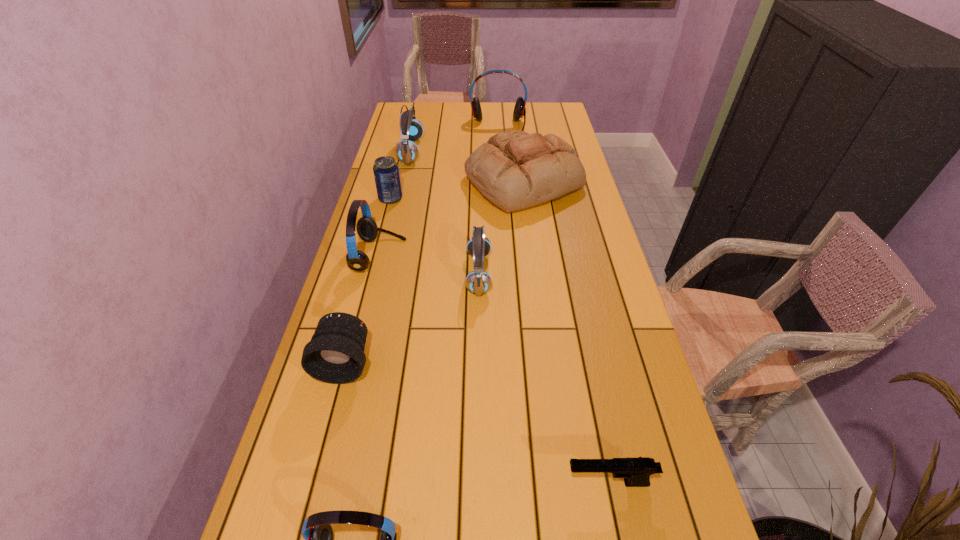
You are a GUI agent. You are given a task and a screenshot of the screen. Output one action in this format:
    pyautogui.click(x=<x>, y=<y>)
    Task: Click on the free location at the right edge of the desktop
    The image size is (960, 540).
    Given the screenshot: What is the action you would take?
    [x=670, y=475]

Find the location of a particular element. vacant space at the far right corner of the desktop is located at coordinates (556, 110).

Where is `vacant space that's between the biggest red headset and the second farthest red headset`? The width and height of the screenshot is (960, 540). vacant space that's between the biggest red headset and the second farthest red headset is located at coordinates (439, 191).

The height and width of the screenshot is (540, 960). I want to click on empty space that is in between the shortest object and the second farthest headset, so click(x=510, y=317).

The height and width of the screenshot is (540, 960). What are the coordinates of `vacant point located between the bread and the nearer blue headset` in the screenshot? It's located at (501, 228).

Identify which object is the second closest to the second nearest object. Please provide its 2D coordinates. Your answer should be formatted as a tuple, i.e. [(x, y)], where the tuple contains the x and y coordinates of a point satisfying the conditions above.

[(335, 354)]

Where is `object that is the third closest to the bread`? This screenshot has width=960, height=540. object that is the third closest to the bread is located at coordinates (406, 151).

Identify which headset is located as the second nearest to the second nearest red headset. Please provide its 2D coordinates. Your answer should be formatted as a tuple, i.e. [(x, y)], where the tuple contains the x and y coordinates of a point satisfying the conditions above.

[(406, 151)]

This screenshot has width=960, height=540. I want to click on headset that is the third closest one to the black telephoto lens, so click(x=318, y=534).

The height and width of the screenshot is (540, 960). Identify the location of red headset identified as the second closest to the smallest red headset. (519, 110).